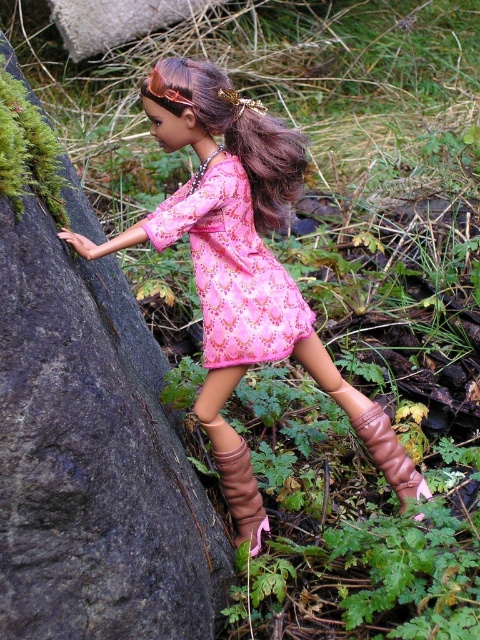
You are a photographer trying to capture the doll in the scene. To frame the shot, you need to know the position of the pink satin dress at center relative to the smooth gray rock at left. Can you tell me which object is positioned to the left?

The smooth gray rock at left is positioned to the left of the pink satin dress at center.